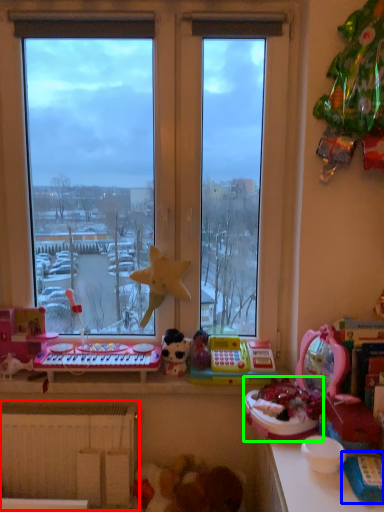
Question: Which object is positioned farthest from radiator (highlighted by a red box)? Select from toy (highlighted by a blue box) and toy (highlighted by a green box).

Choices:
 (A) toy
 (B) toy

Answer: (A)